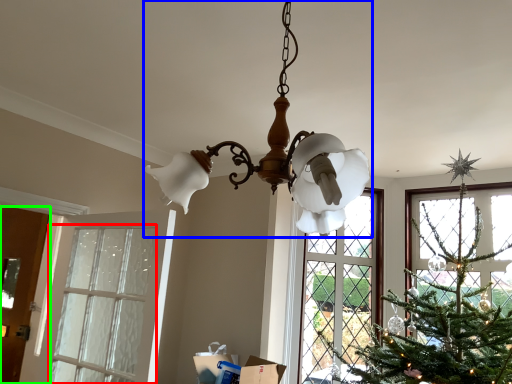
Question: Which is farther away from window (highlighted by a red box)? lamp (highlighted by a blue box) or door (highlighted by a green box)?

Choices:
 (A) lamp
 (B) door

Answer: (A)